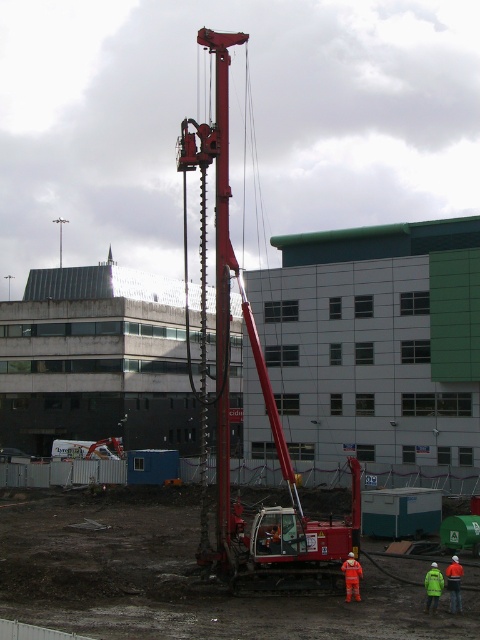
You are a safety inspector standing at the camera position. You need to check the orange reflective safety vest at lower right. Can you reach it within 10 seconds if you walk at a normal pace of 1.4 m per second?

The orange reflective safety vest at lower right is 20.59 meters from camera. At a walking speed of 1.4 m per second, it would take approximately 14.7 seconds to reach it, which exceeds the 10 seconds limit. Therefore, you cannot reach it within the given time frame.

From the picture: You are a safety inspector at the construction site. You need to ensure that the teal matte container at center and the orange reflective vest at lower right are both visible to workers from a distance. Considering their sizes, which object might be harder to see and why?

The teal matte container at center is harder to see because it occupies less space than the orange reflective vest at lower right, making it smaller and potentially less noticeable from a distance.